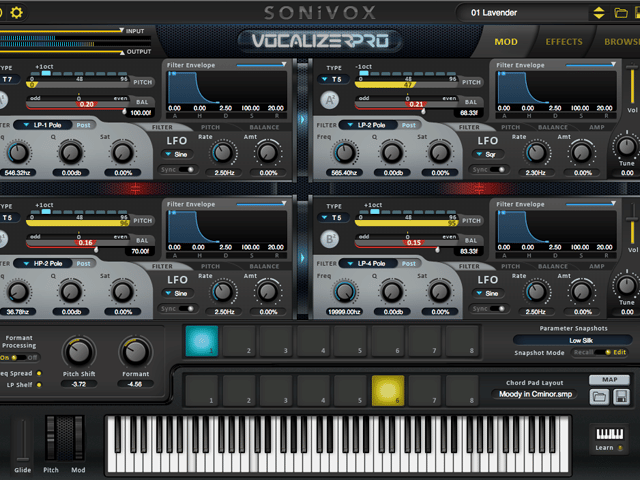
Where is `white keys on keyboard`? This screenshot has width=640, height=480. white keys on keyboard is located at coordinates (109, 455), (152, 462), (244, 462), (317, 460), (409, 458), (454, 459), (513, 462), (545, 464).